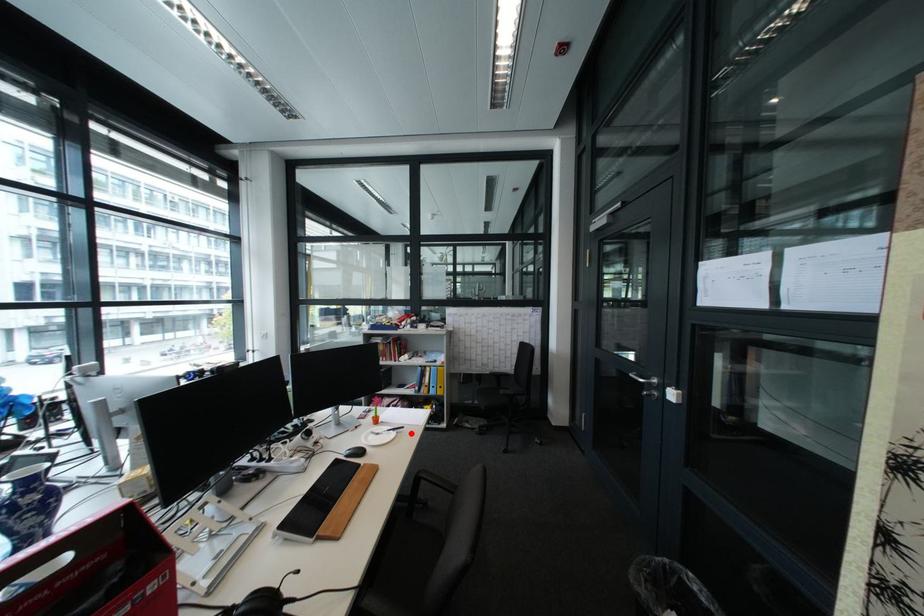
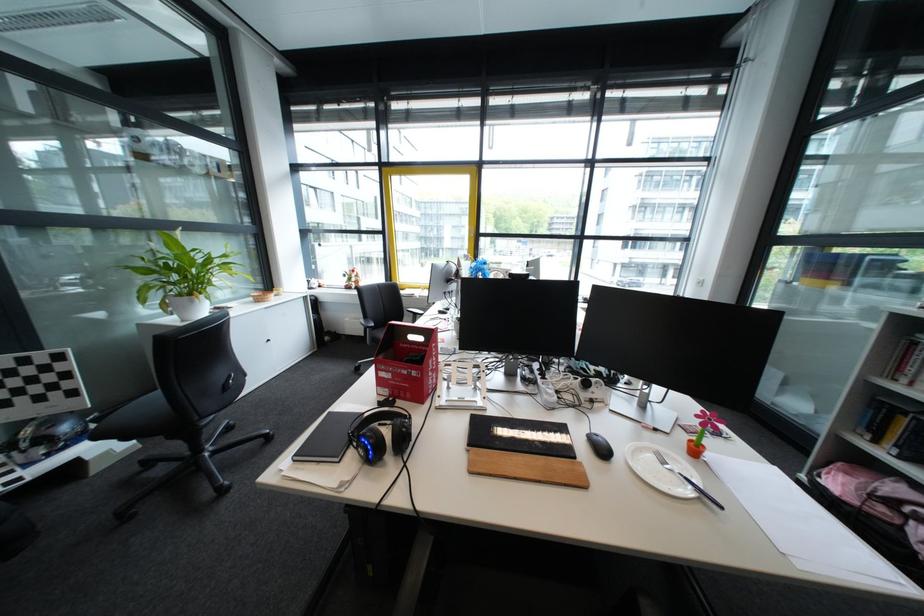
Where in the second image is the point corresponding to the highlighted location from the first image?

(712, 501)